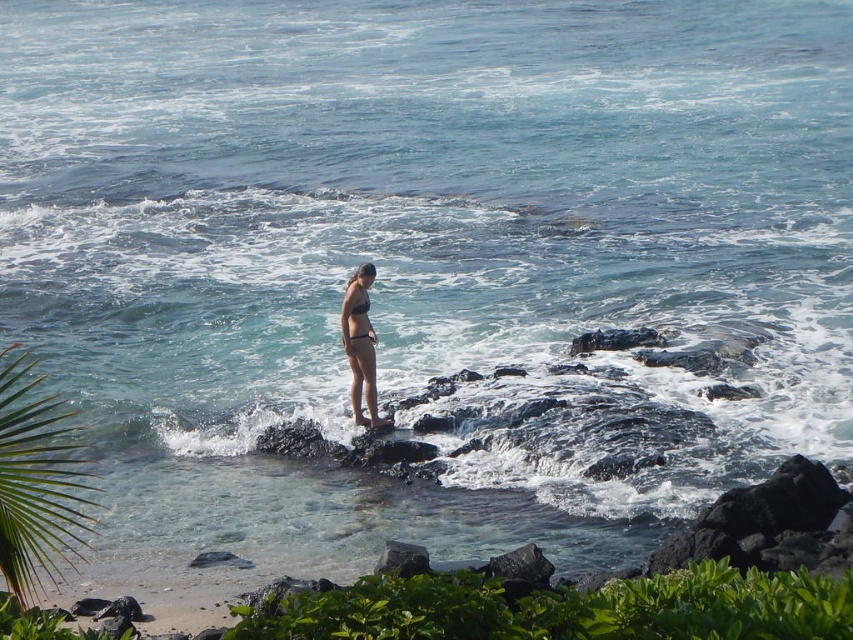
Question: Is matte black bikini at center below matte black bikini top at center?

Choices:
 (A) no
 (B) yes

Answer: (B)

Question: Which of the following is the closest to the observer?

Choices:
 (A) (358, 339)
 (B) (368, 304)
 (C) (404, 552)

Answer: (C)

Question: Which object appears farthest from the camera in this image?

Choices:
 (A) green leafy palm tree at lower left
 (B) matte black bikini top at center

Answer: (B)

Question: Is green leafy palm tree at lower left to the left of matte black bikini top at center from the viewer's perspective?

Choices:
 (A) no
 (B) yes

Answer: (B)

Question: Which point is closer to the camera taking this photo?

Choices:
 (A) tap(392, 568)
 (B) tap(364, 305)
 (C) tap(57, 525)

Answer: (C)

Question: Is green leafy palm tree at lower left to the right of matte black bikini top at center from the viewer's perspective?

Choices:
 (A) no
 (B) yes

Answer: (A)